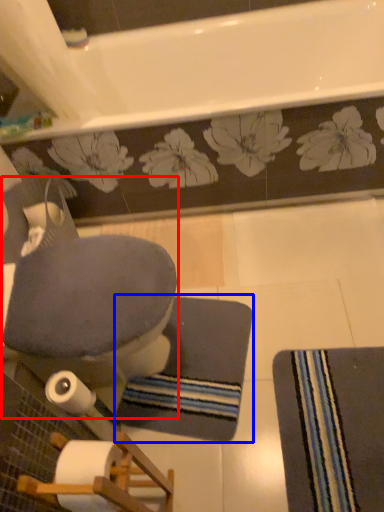
Question: Which point is closer to the camera, rocking chair (highlighted by a red box) or bath mat (highlighted by a blue box)?

Choices:
 (A) rocking chair
 (B) bath mat

Answer: (A)